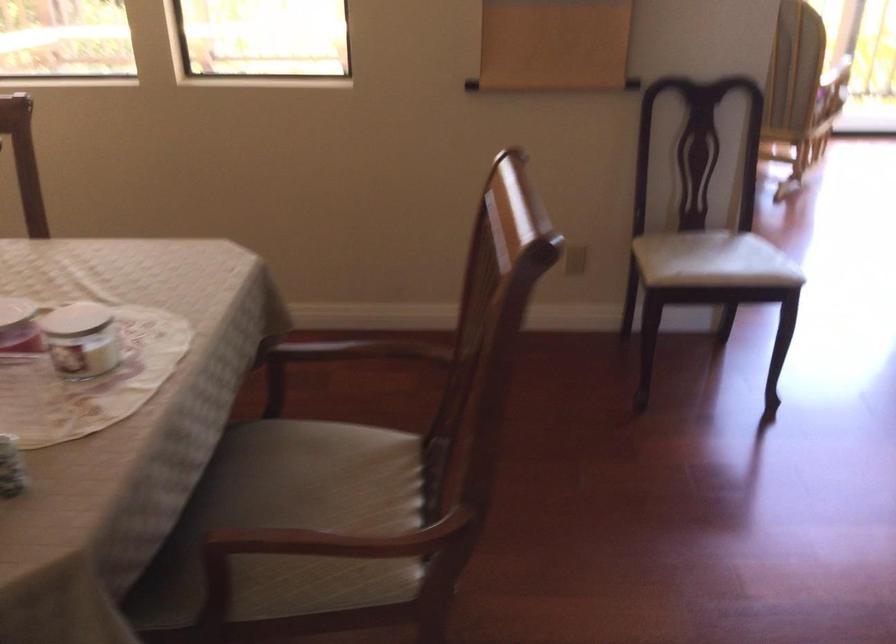
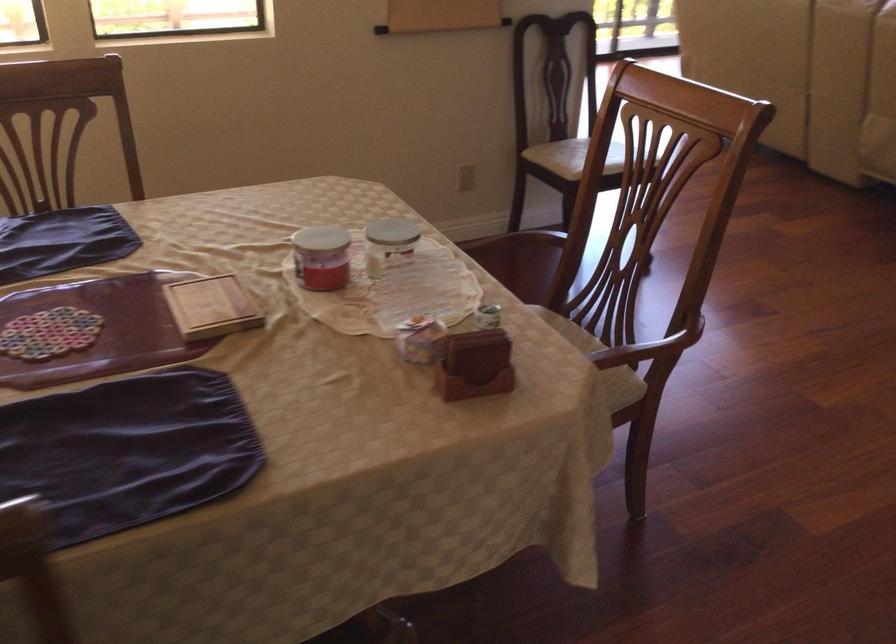
In the second image, find the point that corresponds to point 341,538 in the first image.

(642, 351)